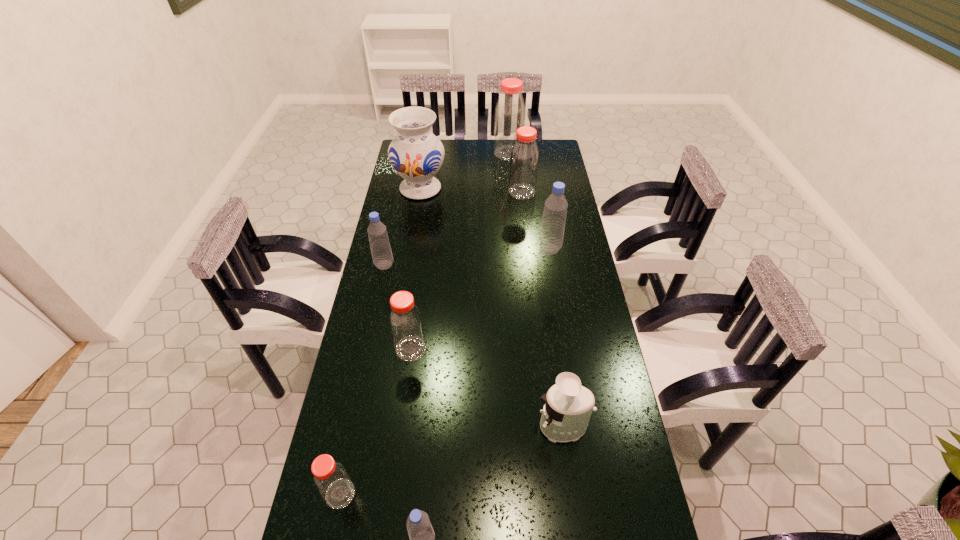
The image size is (960, 540). I want to click on the farthest object, so tap(510, 113).

This screenshot has height=540, width=960. In order to click on the tallest bottle in this screenshot , I will do `click(510, 113)`.

At what (x,y) coordinates should I click in order to perform the action: click on vase. Please return your answer as a coordinate pair (x, y). The height and width of the screenshot is (540, 960). Looking at the image, I should click on (416, 154).

Image resolution: width=960 pixels, height=540 pixels. In order to click on the rightmost blue bottle in this screenshot , I will do `click(552, 230)`.

Where is `the fifth nearest bottle`? the fifth nearest bottle is located at coordinates (552, 230).

Locate an element on the screen. the third smallest red bottle is located at coordinates (524, 159).

Locate an element on the screen. The height and width of the screenshot is (540, 960). the sixth nearest bottle is located at coordinates (524, 159).

Image resolution: width=960 pixels, height=540 pixels. I want to click on the second farthest blue bottle, so click(x=382, y=256).

At what (x,y) coordinates should I click in order to perform the action: click on the fourth farthest bottle. Please return your answer as a coordinate pair (x, y). Looking at the image, I should click on (382, 256).

Image resolution: width=960 pixels, height=540 pixels. In order to click on the third farthest red bottle in this screenshot , I will do `click(405, 320)`.